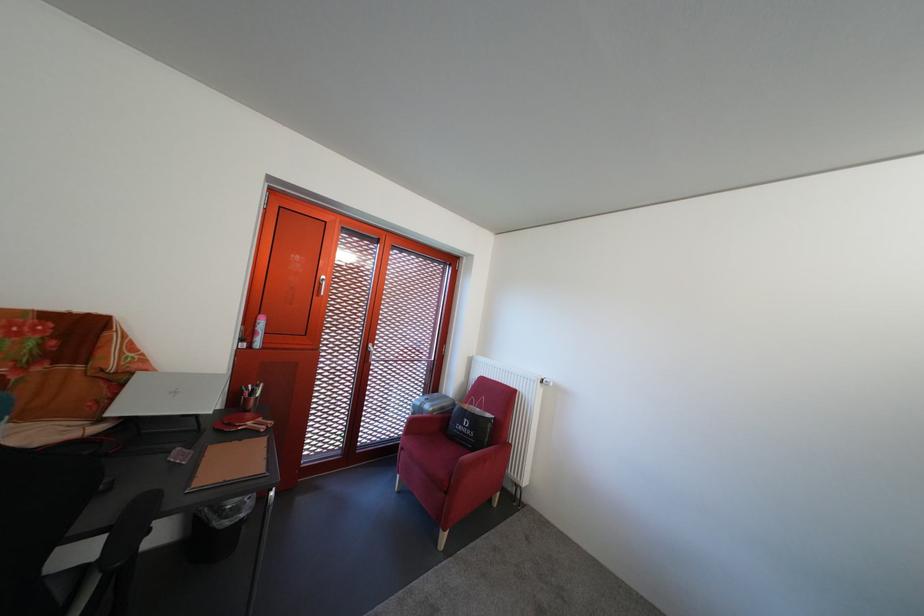
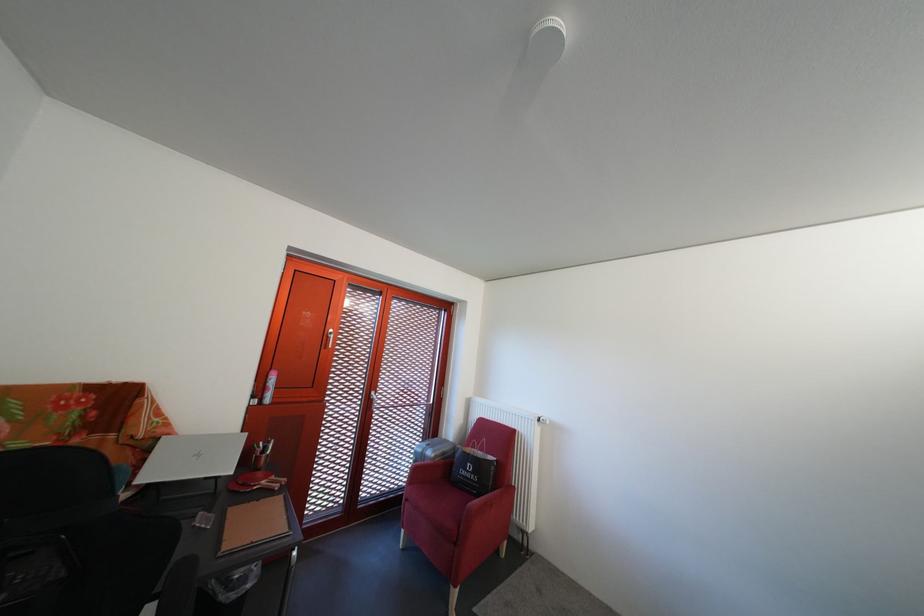
Find the pixel in the second image that matches [187,399] in the first image.

(210, 462)